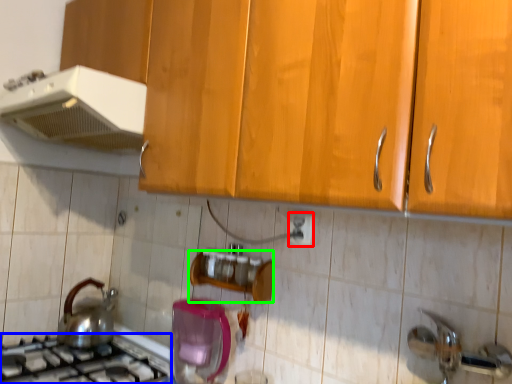
Question: Considering the real-world distances, which object is closest to electric outlet (highlighted by a red box)? gas stove (highlighted by a blue box) or shelf (highlighted by a green box).

Choices:
 (A) gas stove
 (B) shelf

Answer: (B)